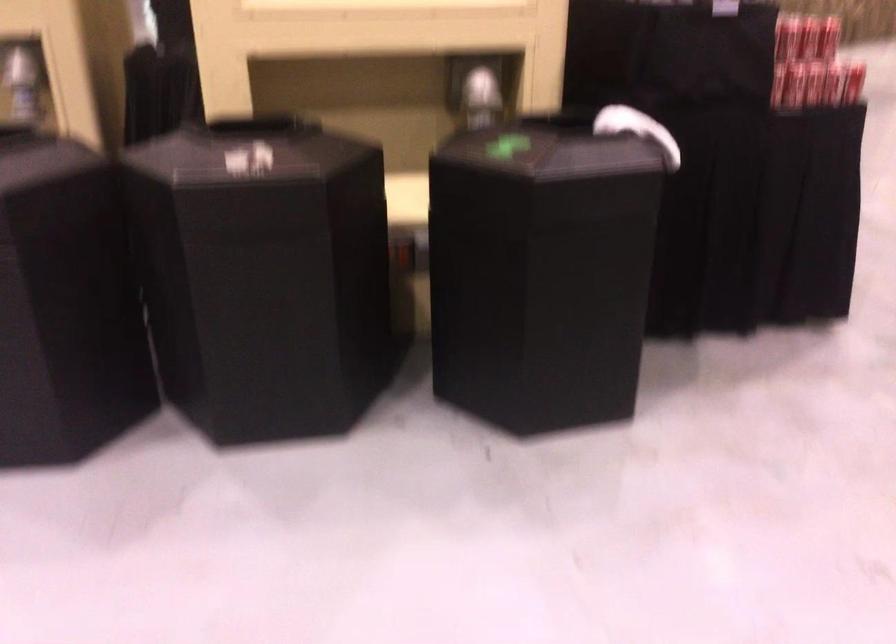
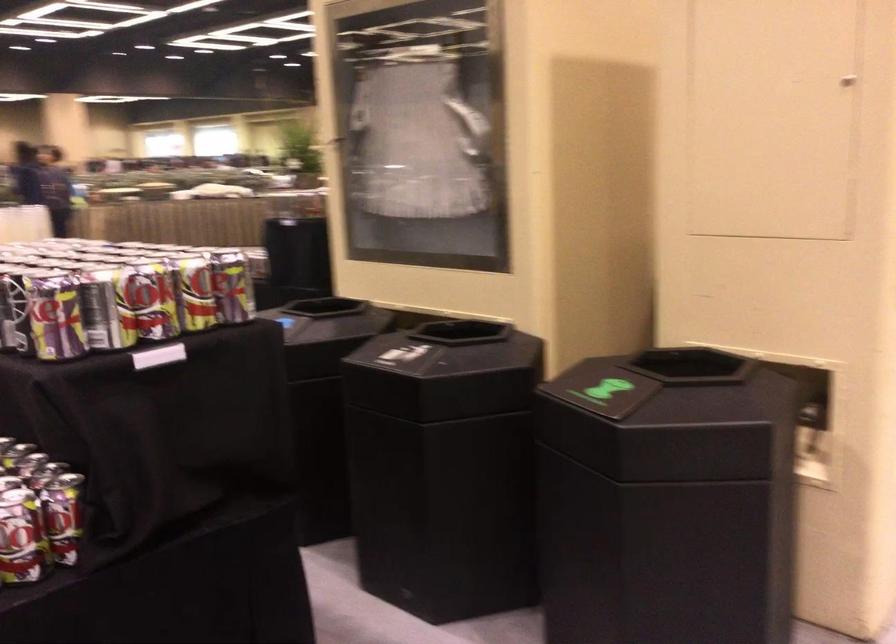
Question: I am providing you with two images of the same scene from different viewpoints. Which of the following objects are not visible in image2?

Choices:
 (A) beverage can
 (B) black bin opening
 (C) white boxing glove
 (D) red soda can

Answer: (D)